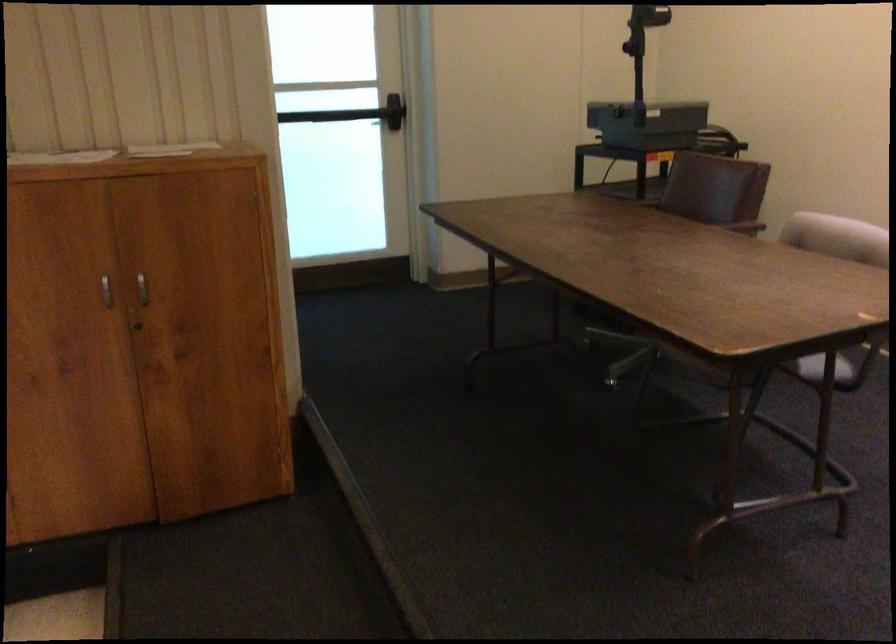
Identify the location of brown chair armrest. This screenshot has height=644, width=896. (739, 223).